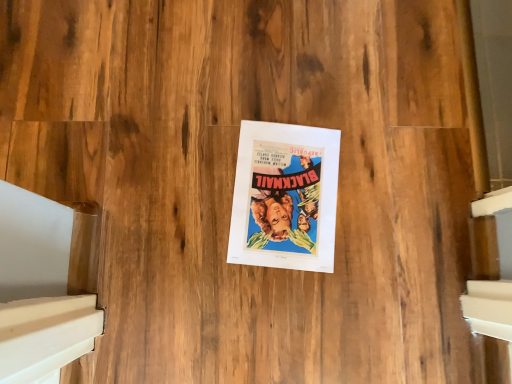
At what (x,y) coordinates should I click in order to perform the action: click on free spot behind matte paper poster at center. Please return your answer as a coordinate pair (x, y). Looking at the image, I should click on (308, 87).